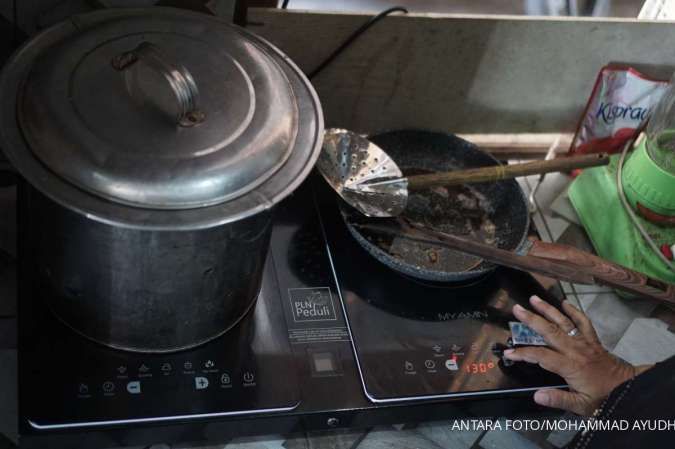
At what (x,y) coordinates should I click in order to perform the action: click on black cord in background. Please return your answer as a coordinate pair (x, y). Looking at the image, I should click on (348, 39), (396, 433).